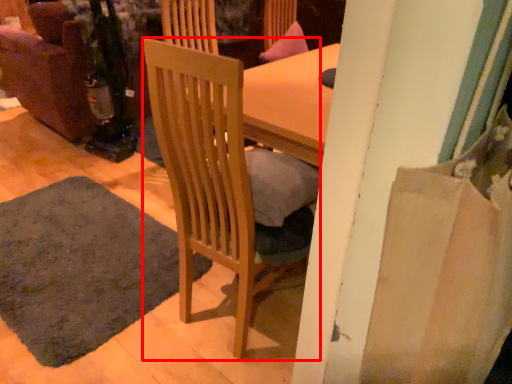
Question: In this image, where is chair (annotated by the red box) located relative to mat?

Choices:
 (A) right
 (B) left

Answer: (A)